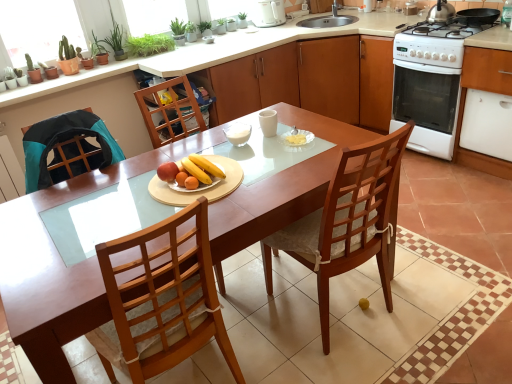
The image size is (512, 384). In order to click on vacant space situated above smooth wooden plate with fruits at center, the second fruit dish from the right (from a real-world perspective) in this screenshot , I will do `click(199, 179)`.